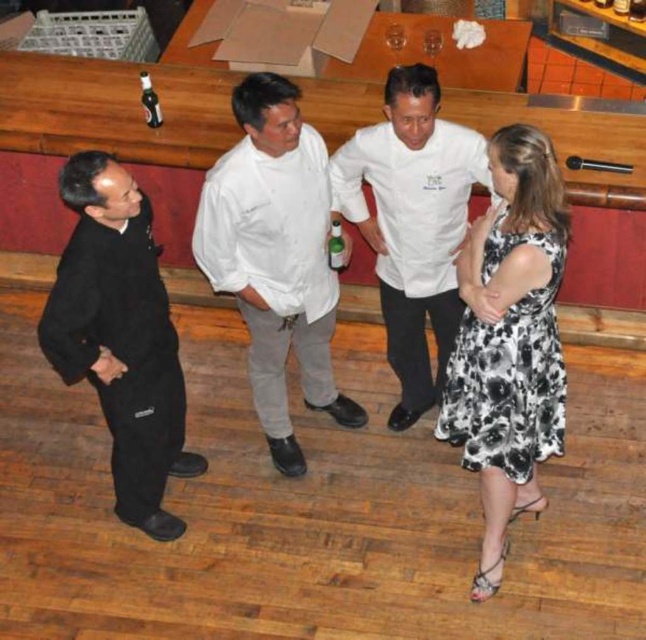
Question: Considering the relative positions of black matte suit at left and clear glass bottle at upper left in the image provided, where is black matte suit at left located with respect to clear glass bottle at upper left?

Choices:
 (A) left
 (B) right

Answer: (B)

Question: Which point appears farthest from the camera in this image?

Choices:
 (A) (141, 106)
 (B) (207, 266)
 (C) (638, 20)
 (D) (331, 240)

Answer: (C)

Question: Does white cotton chef coat at center appear on the left side of green glass bottle at center?

Choices:
 (A) no
 (B) yes

Answer: (B)

Question: Can you confirm if white cotton chef coat at center is thinner than black floral dress at lower right?

Choices:
 (A) no
 (B) yes

Answer: (A)

Question: Which object is farther from the camera taking this photo?

Choices:
 (A) white cotton chef coat at center
 (B) green glass bottle at center
 (C) black matte suit at left

Answer: (B)

Question: Estimate the real-world distances between objects in this image. Which object is closer to the black floral dress at lower right?

Choices:
 (A) clear glass bottle at upper center
 (B) black matte suit at left
 (C) green glass bottle at center
 (D) white chef coat at center

Answer: (D)